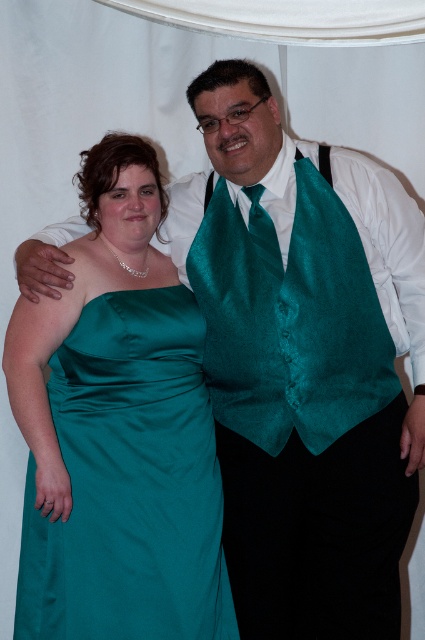
Question: Among these points, which one is nearest to the camera?

Choices:
 (A) (204, 602)
 (B) (345, 426)

Answer: (A)

Question: Can you confirm if satin teal dress at center is bigger than teal satin vest at center?

Choices:
 (A) no
 (B) yes

Answer: (B)

Question: Can you confirm if teal satin vest at center is thinner than teal satin tie at center?

Choices:
 (A) yes
 (B) no

Answer: (B)

Question: Among these points, which one is farthest from the camera?

Choices:
 (A) (257, 212)
 (B) (265, 273)

Answer: (A)

Question: Is satin teal dress at center to the right of teal satin tie at center from the viewer's perspective?

Choices:
 (A) no
 (B) yes

Answer: (A)

Question: Which of the following is the farthest from the observer?

Choices:
 (A) teal satin vest at center
 (B) teal satin tie at center

Answer: (B)